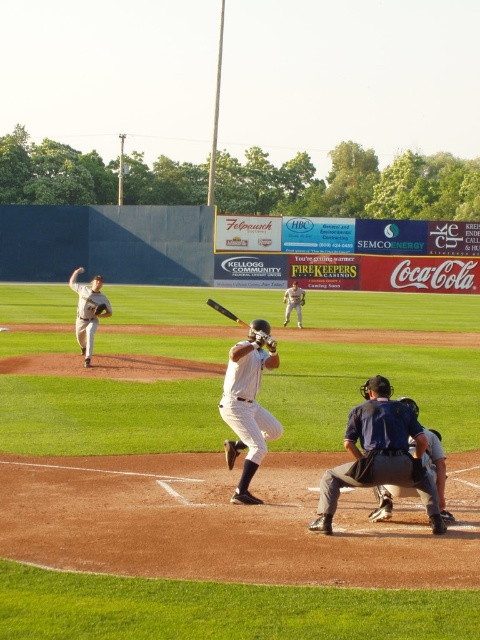
You are a photographer standing at the edge of the baseball field. You want to take a photo that includes both the point at coordinates point(76, 272) and point(300, 296). Which point will appear closer to the bottom of the photo?

Point(76, 272) is further to the camera than point(300, 296), so point(300, 296) will appear closer to the bottom of the photo.

You are a drone operator trying to capture the best aerial shot of the baseball game. The camera is currently positioned at point A, which is at coordinates 0.5, 0.6. The white uniform baseball player at center is your main subject. Is the player within the camera frame? Please explain based on their coordinates.

The white uniform baseball player at center is at coordinates (294, 301). The camera is at (288, 320). Since the player is very close to the camera position, they are likely within the camera frame.